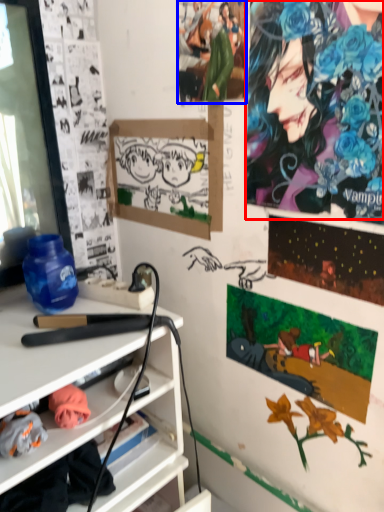
Question: Which object appears closest to the camera in this image, person (highlighted by a red box) or person (highlighted by a blue box)?

Choices:
 (A) person
 (B) person

Answer: (A)